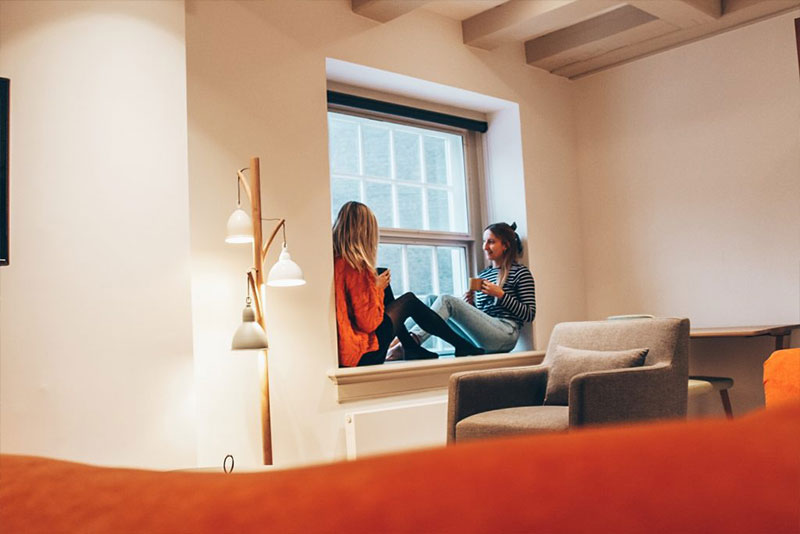
This screenshot has height=534, width=800. Find the location of `white light fixtures`. white light fixtures is located at coordinates (236, 227), (288, 267), (252, 329).